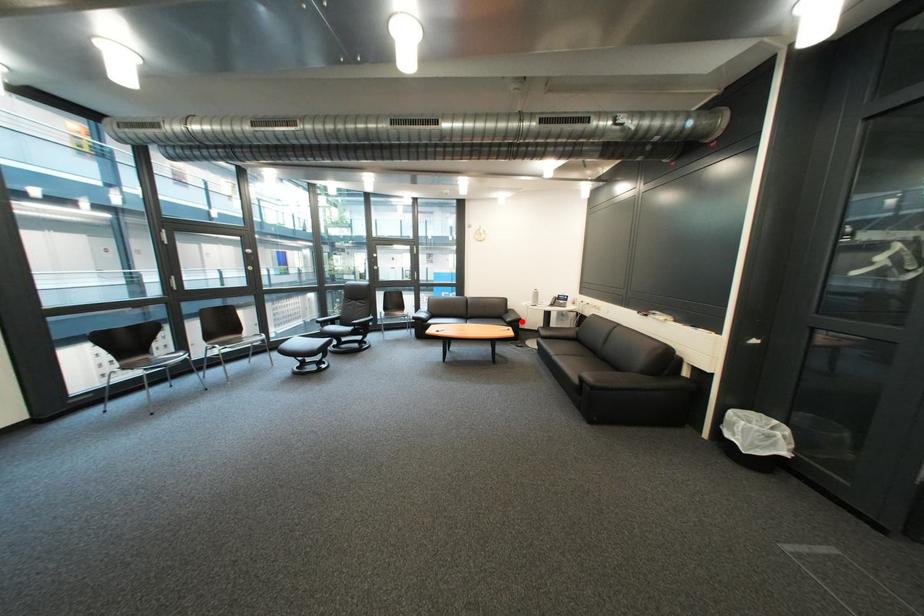
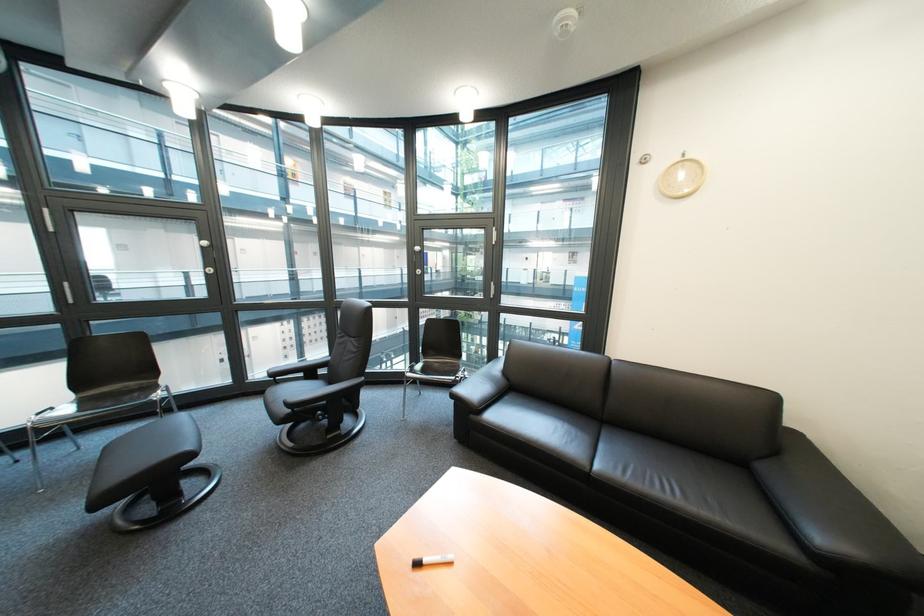
Where in the second image is the point corresponding to the highlighted location from the first image?

(833, 540)